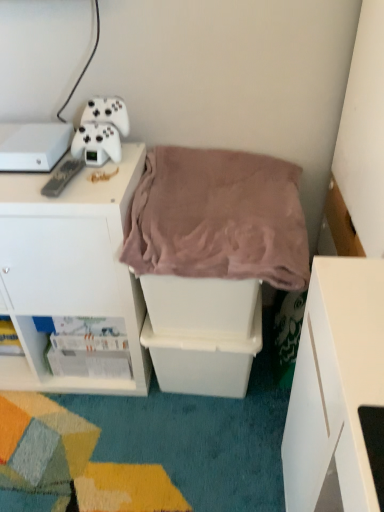
Locate an element on the screen. free space to the left of white glossy magazine at lower left, which ranks as the second shelf in right-to-left order is located at coordinates (28, 397).